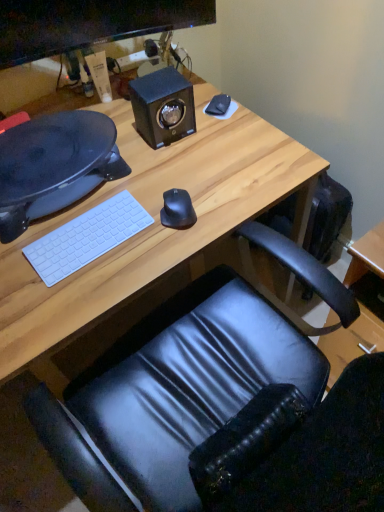
This screenshot has height=512, width=384. In order to click on unoccupied space behind black matte mouse at center in this screenshot , I will do `click(174, 174)`.